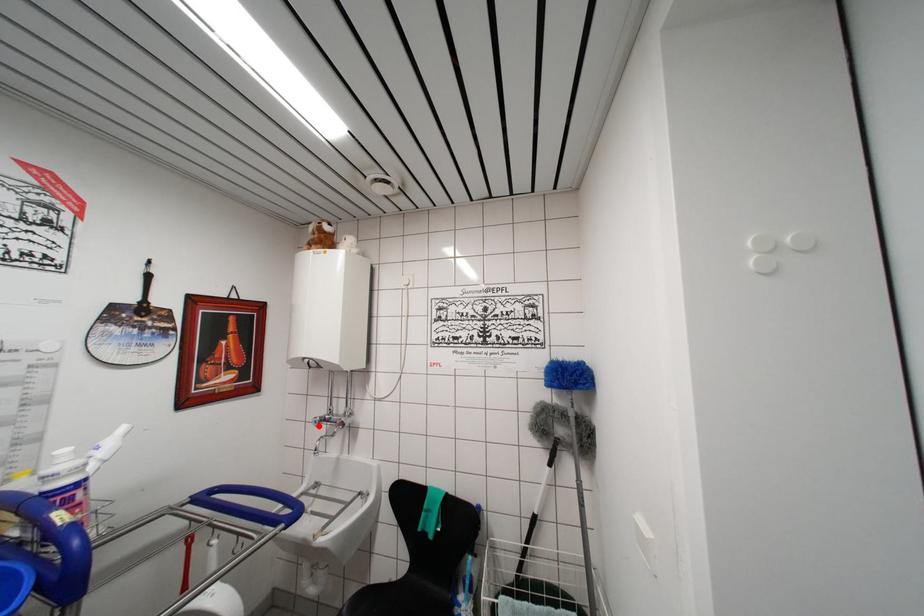
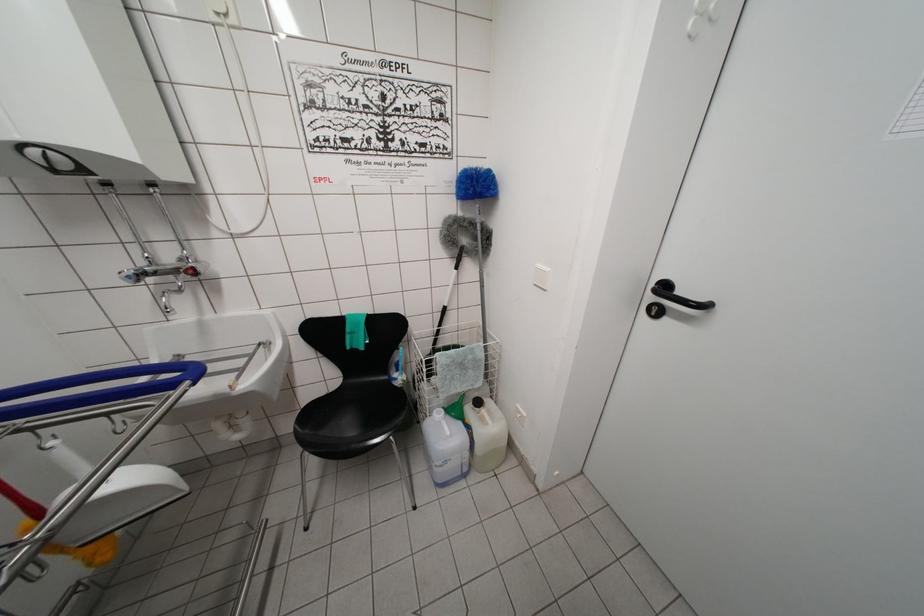
Question: I am providing you with two images of the same scene from different viewpoints. A red point is marked on the first image. At the location where the point appears in image 1, is it still visible in image 2?

Choices:
 (A) Yes
 (B) No

Answer: (A)